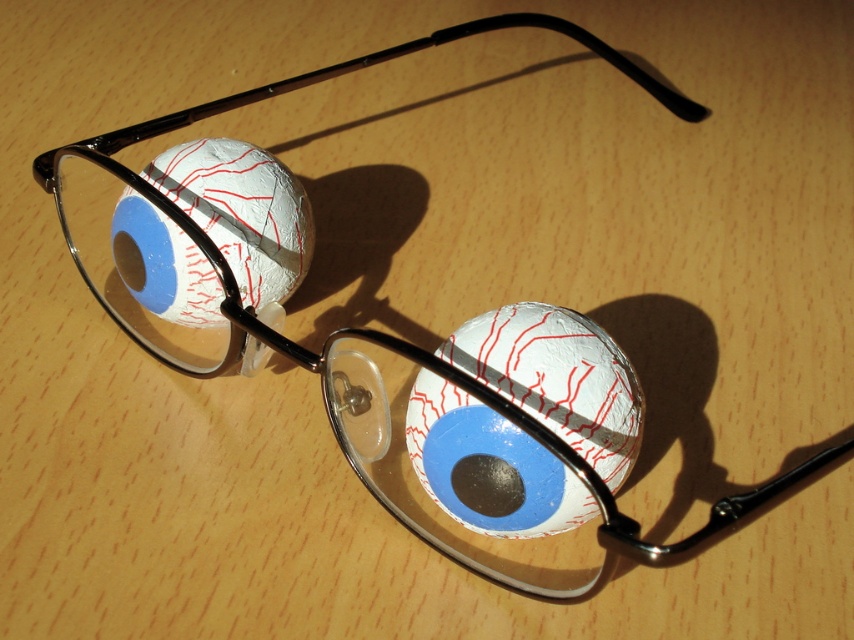
Question: Which point is closer to the camera taking this photo?

Choices:
 (A) (294, 204)
 (B) (583, 502)

Answer: (B)

Question: Which of the following is the farthest from the observer?

Choices:
 (A) white crinkled paper eyeball at center
 (B) white crinkled baseball at left

Answer: (B)

Question: Is white crinkled paper eyeball at center thinner than white crinkled baseball at left?

Choices:
 (A) yes
 (B) no

Answer: (B)

Question: Does white crinkled paper eyeball at center have a smaller size compared to white crinkled baseball at left?

Choices:
 (A) yes
 (B) no

Answer: (B)

Question: Can you confirm if white crinkled paper eyeball at center is positioned to the right of white crinkled baseball at left?

Choices:
 (A) yes
 (B) no

Answer: (A)